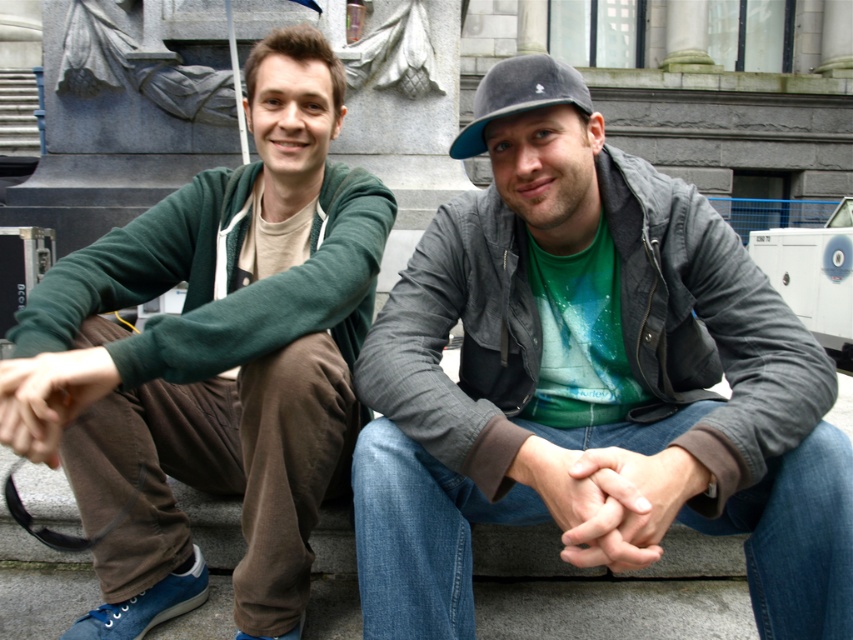
Who is positioned more to the left, matte gray jacket at center or brown suede handbag at lower left?

Positioned to the left is brown suede handbag at lower left.

Who is shorter, matte gray jacket at center or brown suede handbag at lower left?

With less height is brown suede handbag at lower left.

Does point (563, 163) come closer to viewer compared to point (10, 426)?

No, (563, 163) is behind (10, 426).

Where is `matte gray jacket at center`? This screenshot has width=853, height=640. matte gray jacket at center is located at coordinates (590, 381).

Can you confirm if smooth skin hands at center is thinner than gray felt baseball cap at center?

Yes, smooth skin hands at center is thinner than gray felt baseball cap at center.

Who is more distant from viewer, (637, 536) or (572, 102)?

Positioned behind is point (572, 102).

Which is behind, point (577, 538) or point (537, 76)?

Point (537, 76)

Identify the location of smooth skin hands at center. This screenshot has width=853, height=640. (625, 504).

Does point (570, 346) come behind point (158, 429)?

No.

The width and height of the screenshot is (853, 640). What do you see at coordinates (590, 381) in the screenshot? I see `matte gray jacket at center` at bounding box center [590, 381].

Where is `matte gray jacket at center`? The height and width of the screenshot is (640, 853). matte gray jacket at center is located at coordinates (590, 381).